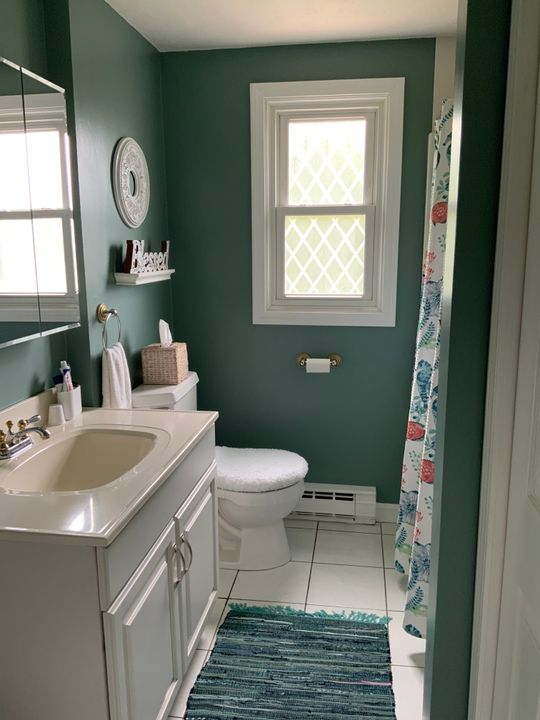
At what (x,y) coordinates should I click in order to perform the action: click on 1 shower curtain. Please return your answer as a coordinate pair (x, y). Looking at the image, I should click on (414, 498).